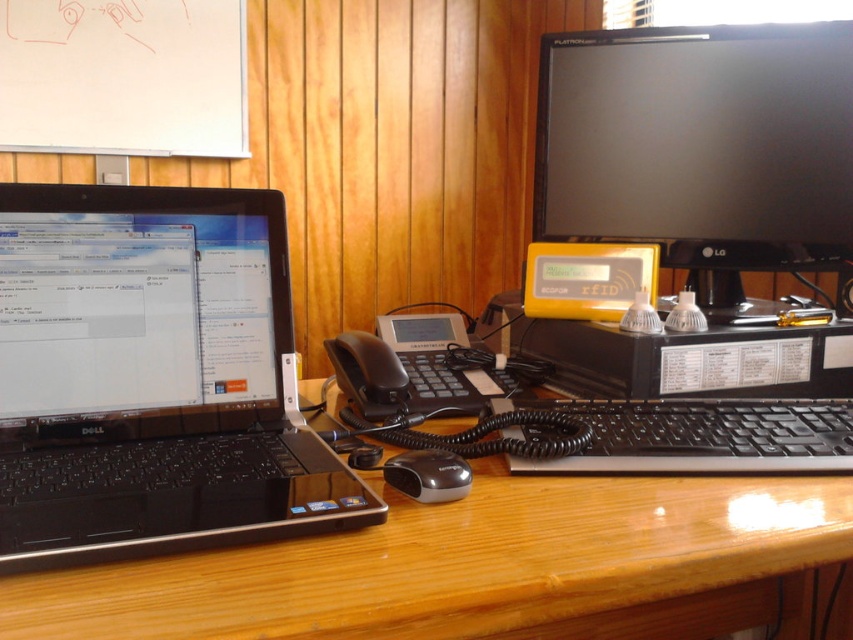
You are standing in front of the workspace and want to reach the point at coordinates point (x=78, y=637). Can you estimate how far you need to reach to touch it?

The point (x=78, y=637) is 16.34 inches away from the camera, so you need to reach approximately 16.34 inches to touch it.

You are standing in front of the desk and want to reach both points. Which point, point (53, 588) or point (750, 195), will you need to move closer to the desk to reach?

Point (750, 195) is further away from the viewer, so you would need to move closer to the desk to reach it.

You are setting up a new webcam for a video call. The webcam has a recommended distance of 20 inches for optimal performance. Based on the scene, can the webcam be placed between the black matte laptop at left and the black glossy monitor at upper right to ensure it is within the recommended distance?

The black matte laptop at left is 21.69 inches away from the black glossy monitor at upper right. Since the recommended distance is 20 inches, placing the webcam between them would exceed the optimal range, so it might not capture the best quality. Consider moving the laptop or monitor closer.